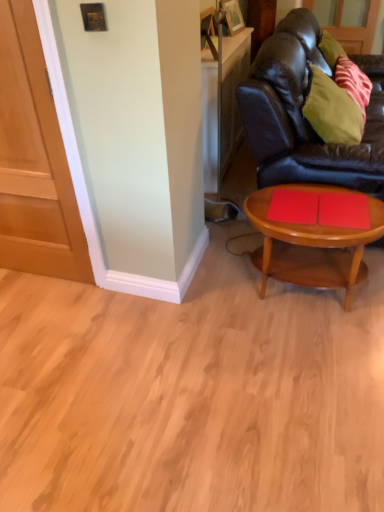
Describe the element at coordinates (332, 111) in the screenshot. This screenshot has width=384, height=512. I see `green fabric pillow at upper right` at that location.

What is the approximate height of wooden coffee table at lower right?

wooden coffee table at lower right is 18.03 inches tall.

Where is `wooden coffee table at lower right`? wooden coffee table at lower right is located at coordinates (313, 234).

Where is `green fabric pillow at upper right`? The width and height of the screenshot is (384, 512). green fabric pillow at upper right is located at coordinates pos(332,111).

Can matte wood door at left be found inside wooden coffee table at lower right?

Actually, matte wood door at left is outside wooden coffee table at lower right.

Which object is thinner, wooden coffee table at lower right or matte wood door at left?

With smaller width is matte wood door at left.

Is wooden coffee table at lower right taller than matte wood door at left?

No.

Measure the distance from matte wood door at left to green fabric pillow at upper right.

1.37 meters.

Does matte wood door at left come behind green fabric pillow at upper right?

No, it is not.

Is matte wood door at left next to green fabric pillow at upper right and touching it?

No.

Looking at this image, from the image's perspective, is matte wood door at left located above or below green fabric pillow at upper right?

From the image's perspective, matte wood door at left appears below green fabric pillow at upper right.

Which of these two, green fabric pillow at upper right or black leather couch at right, stands shorter?

Standing shorter between the two is green fabric pillow at upper right.

You are a GUI agent. You are given a task and a screenshot of the screen. Output one action in this format:
    pyautogui.click(x=<x>, y=<y>)
    Task: Click on the pillow below the black leather couch at right (from the image's perspective)
    This screenshot has height=512, width=384.
    Given the screenshot: What is the action you would take?
    pyautogui.click(x=332, y=111)

Does point (314, 106) appear closer or farther from the camera than point (296, 18)?

Point (314, 106) appears to be closer to the viewer than point (296, 18).

Which object is closer to the camera, green fabric pillow at upper right or black leather couch at right?

black leather couch at right is more forward.

The width and height of the screenshot is (384, 512). I want to click on coffee table on the left of the black leather couch at right, so click(313, 234).

Can you confirm if black leather couch at right is positioned to the right of wooden coffee table at lower right?

Yes, black leather couch at right is to the right of wooden coffee table at lower right.

Based on the photo, looking at the image, does black leather couch at right seem bigger or smaller compared to wooden coffee table at lower right?

black leather couch at right is bigger than wooden coffee table at lower right.

The width and height of the screenshot is (384, 512). Identify the location of door that is above the wooden coffee table at lower right (from a real-world perspective). (34, 160).

Is matte wood door at left beside wooden coffee table at lower right?

No, matte wood door at left is not with wooden coffee table at lower right.

Is matte wood door at left positioned with its back to wooden coffee table at lower right?

No, wooden coffee table at lower right is not at the back of matte wood door at left.

In the image, is matte wood door at left positioned in front of or behind wooden coffee table at lower right?

matte wood door at left is positioned closer to the viewer than wooden coffee table at lower right.

Could you tell me if wooden coffee table at lower right is facing green fabric pillow at upper right?

No, wooden coffee table at lower right is not oriented towards green fabric pillow at upper right.

From their relative heights in the image, would you say wooden coffee table at lower right is taller or shorter than green fabric pillow at upper right?

In the image, wooden coffee table at lower right appears to be taller than green fabric pillow at upper right.

From the image's perspective, is wooden coffee table at lower right under green fabric pillow at upper right?

Yes.

Considering the points (349, 278) and (308, 99), which point is behind, point (349, 278) or point (308, 99)?

The point (308, 99) is farther from the camera.

Considering the relative sizes of green fabric pillow at upper right and matte wood door at left in the image provided, is green fabric pillow at upper right taller than matte wood door at left?

No.

Image resolution: width=384 pixels, height=512 pixels. Find the location of `door lying on the left of green fabric pillow at upper right`. door lying on the left of green fabric pillow at upper right is located at coordinates (34, 160).

In terms of width, does green fabric pillow at upper right look wider or thinner when compared to matte wood door at left?

Considering their sizes, green fabric pillow at upper right looks broader than matte wood door at left.

In order to click on door on the left of the wooden coffee table at lower right in this screenshot , I will do `click(34, 160)`.

This screenshot has height=512, width=384. I want to click on pillow on the right of matte wood door at left, so click(332, 111).

Estimate the real-world distances between objects in this image. Which object is closer to green fabric pillow at upper right, black leather couch at right or wooden coffee table at lower right?

The object closer to green fabric pillow at upper right is black leather couch at right.

When comparing their distances from matte wood door at left, does black leather couch at right or green fabric pillow at upper right seem closer?

The object closer to matte wood door at left is black leather couch at right.

Looking at the image, which one is located closer to wooden coffee table at lower right, black leather couch at right or green fabric pillow at upper right?

green fabric pillow at upper right is closer to wooden coffee table at lower right.

From the image, which object appears to be farther from green fabric pillow at upper right, matte wood door at left or black leather couch at right?

matte wood door at left is positioned further to the anchor green fabric pillow at upper right.

Based on the photo, looking at the image, which one is located closer to green fabric pillow at upper right, matte wood door at left or wooden coffee table at lower right?

wooden coffee table at lower right is positioned closer to the anchor green fabric pillow at upper right.

Looking at the image, which one is located closer to wooden coffee table at lower right, matte wood door at left or black leather couch at right?

black leather couch at right lies closer to wooden coffee table at lower right than the other object.

Estimate the real-world distances between objects in this image. Which object is further from matte wood door at left, black leather couch at right or wooden coffee table at lower right?

black leather couch at right.

When comparing their distances from black leather couch at right, does matte wood door at left or wooden coffee table at lower right seem further?

matte wood door at left.

Find the location of `pillow between black leather couch at right and wooden coffee table at lower right vertically`. pillow between black leather couch at right and wooden coffee table at lower right vertically is located at coordinates (332, 111).

Identify the location of coffee table between matte wood door at left and black leather couch at right. The image size is (384, 512). (313, 234).

At what (x,y) coordinates should I click in order to perform the action: click on pillow between matte wood door at left and black leather couch at right. Please return your answer as a coordinate pair (x, y). Looking at the image, I should click on (332, 111).

At what (x,y) coordinates should I click in order to perform the action: click on coffee table between matte wood door at left and green fabric pillow at upper right from left to right. Please return your answer as a coordinate pair (x, y). The height and width of the screenshot is (512, 384). Looking at the image, I should click on (313, 234).